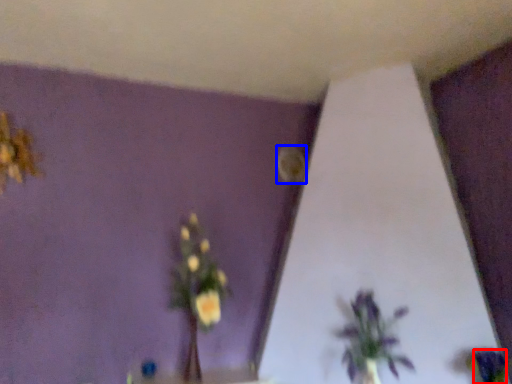
Question: Which of the following is the farthest to the observer, flower (highlighted by a red box) or flower (highlighted by a blue box)?

Choices:
 (A) flower
 (B) flower

Answer: (B)